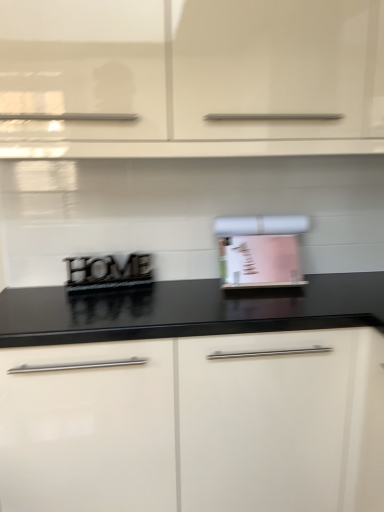
Question: Is pink paper towel holder at center, the first appliance viewed from the right, far from white glossy cabinet at upper center, which is counted as the 1th cabinetry, starting from the top?

Choices:
 (A) no
 (B) yes

Answer: (A)

Question: From a real-world perspective, does pink paper towel holder at center, which appears as the 2th appliance when viewed from the left, sit lower than white glossy cabinet at upper center, which is counted as the 1th cabinetry, starting from the top?

Choices:
 (A) yes
 (B) no

Answer: (A)

Question: Can you confirm if pink paper towel holder at center, which appears as the 2th appliance when viewed from the left, is positioned to the right of white glossy cabinet at upper center, which is counted as the 1th cabinetry, starting from the top?

Choices:
 (A) no
 (B) yes

Answer: (B)

Question: Are pink paper towel holder at center, the first appliance viewed from the right, and white glossy cabinet at upper center, placed as the 2th cabinetry when sorted from bottom to top, making contact?

Choices:
 (A) no
 (B) yes

Answer: (A)

Question: Does pink paper towel holder at center, the first appliance viewed from the right, appear on the left side of white glossy cabinet at upper center, which is counted as the 1th cabinetry, starting from the top?

Choices:
 (A) yes
 (B) no

Answer: (B)

Question: Looking at the image, does white glossy cabinet at upper center, which is counted as the 1th cabinetry, starting from the top, seem bigger or smaller compared to pink paper towel holder at center, the first appliance viewed from the right?

Choices:
 (A) small
 (B) big

Answer: (B)

Question: From a real-world perspective, is white glossy cabinet at upper center, placed as the 2th cabinetry when sorted from bottom to top, positioned above or below pink paper towel holder at center, the first appliance viewed from the right?

Choices:
 (A) below
 (B) above

Answer: (B)

Question: Is white glossy cabinet at upper center, which is counted as the 1th cabinetry, starting from the top, taller or shorter than pink paper towel holder at center, which appears as the 2th appliance when viewed from the left?

Choices:
 (A) tall
 (B) short

Answer: (A)

Question: Considering the positions of point (233, 100) and point (238, 265), is point (233, 100) closer or farther from the camera than point (238, 265)?

Choices:
 (A) closer
 (B) farther

Answer: (A)

Question: From the image's perspective, is white glossy cabinet at upper center, placed as the 2th cabinetry when sorted from bottom to top, above or below metallic black sign at center, the first appliance when ordered from left to right?

Choices:
 (A) above
 (B) below

Answer: (A)

Question: In terms of height, does white glossy cabinet at upper center, which is counted as the 1th cabinetry, starting from the top, look taller or shorter compared to metallic black sign at center, which ranks as the second appliance in right-to-left order?

Choices:
 (A) tall
 (B) short

Answer: (A)

Question: Is white glossy cabinet at upper center, placed as the 2th cabinetry when sorted from bottom to top, bigger or smaller than metallic black sign at center, which ranks as the second appliance in right-to-left order?

Choices:
 (A) small
 (B) big

Answer: (B)

Question: Which is correct: white glossy cabinet at upper center, which is counted as the 1th cabinetry, starting from the top, is inside metallic black sign at center, which ranks as the second appliance in right-to-left order, or outside of it?

Choices:
 (A) inside
 (B) outside

Answer: (B)

Question: From a real-world perspective, is metallic black sign at center, which ranks as the second appliance in right-to-left order, physically located above or below white glossy cabinet at center, the 1th cabinetry when ordered from bottom to top?

Choices:
 (A) below
 (B) above

Answer: (B)

Question: Based on their positions, is metallic black sign at center, which ranks as the second appliance in right-to-left order, located to the left or right of white glossy cabinet at center, the 1th cabinetry when ordered from bottom to top?

Choices:
 (A) right
 (B) left

Answer: (B)